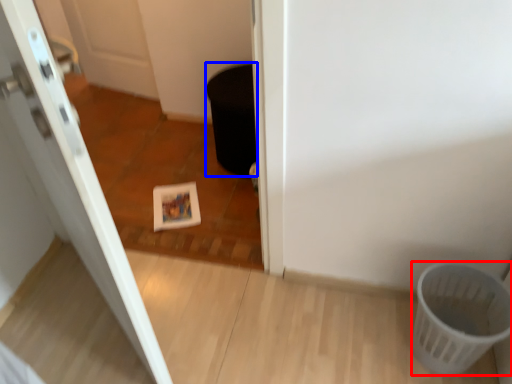
Question: Which point is closer to the camera, basket (highlighted by a red box) or potty (highlighted by a blue box)?

Choices:
 (A) basket
 (B) potty

Answer: (A)